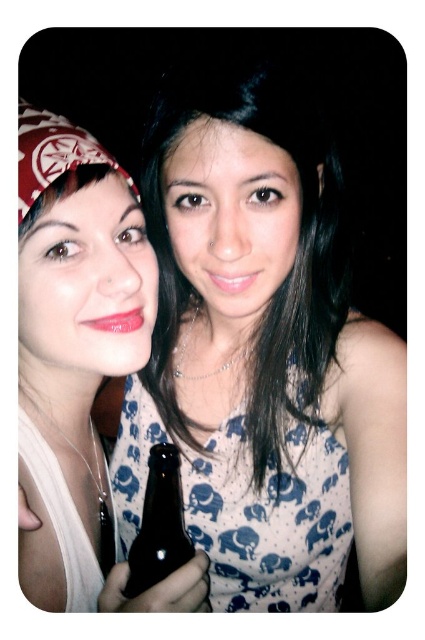
Between matte white dress at center and matte white tank top at left, which one appears on the right side from the viewer's perspective?

matte white dress at center is more to the right.

Who is more distant from viewer, (343, 264) or (193, 563)?

The point (343, 264) is behind.

This screenshot has width=425, height=640. Find the location of `matte white dress at center`. matte white dress at center is located at coordinates (263, 356).

Does matte white tank top at left appear under dark glass bottle at center?

Incorrect, matte white tank top at left is not positioned below dark glass bottle at center.

Describe the element at coordinates (73, 324) in the screenshot. I see `matte white tank top at left` at that location.

The width and height of the screenshot is (425, 640). Describe the element at coordinates (73, 324) in the screenshot. I see `matte white tank top at left` at that location.

Where is `matte white tank top at left`? The image size is (425, 640). matte white tank top at left is located at coordinates (73, 324).

Between matte white dress at center and dark glass bottle at center, which one has less height?

dark glass bottle at center is shorter.

Which is above, matte white dress at center or dark glass bottle at center?

Positioned higher is matte white dress at center.

This screenshot has height=640, width=425. In order to click on matte white dress at center in this screenshot , I will do `click(263, 356)`.